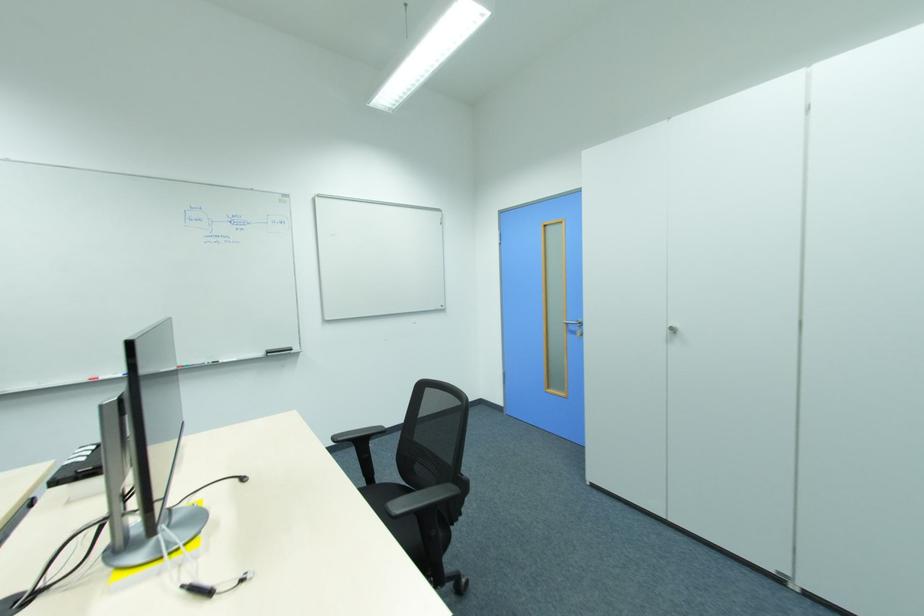
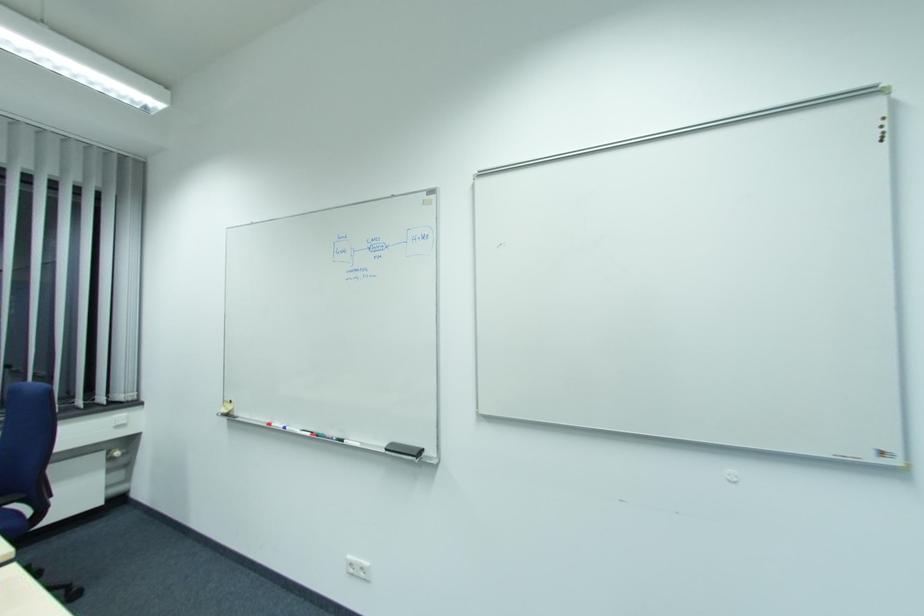
Locate, in the second image, the point that corresponds to point (217, 362) in the first image.

(344, 440)